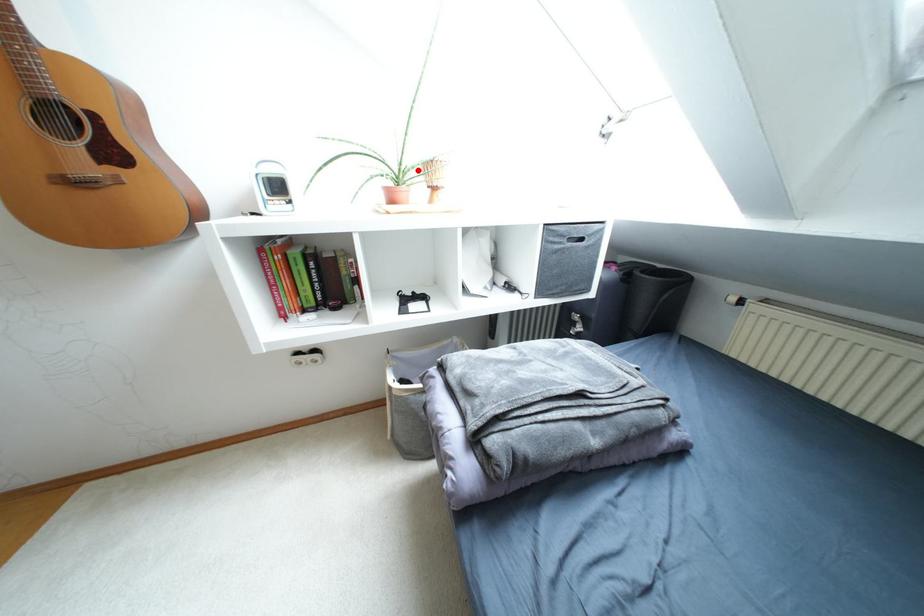
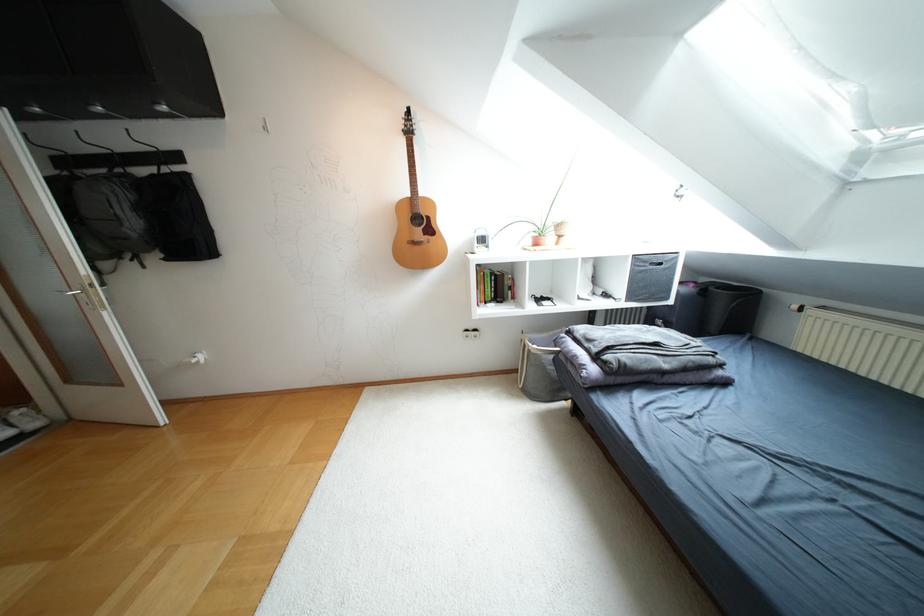
The point at the highlighted location is marked in the first image. Where is the corresponding point in the second image?

(552, 227)